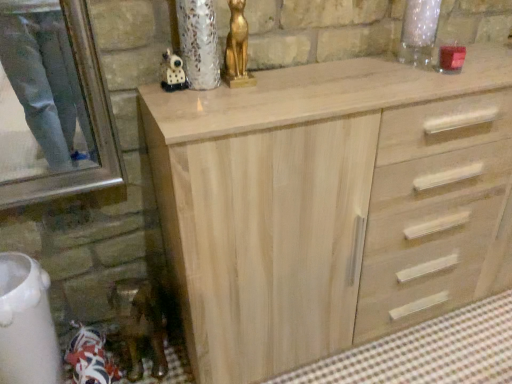
Question: From a real-world perspective, is gold metallic cat statue at upper center physically below natural wood cabinet at center?

Choices:
 (A) yes
 (B) no

Answer: (B)

Question: From the image's perspective, is gold metallic cat statue at upper center located above natural wood cabinet at center?

Choices:
 (A) no
 (B) yes

Answer: (B)

Question: Does gold metallic cat statue at upper center turn towards natural wood cabinet at center?

Choices:
 (A) yes
 (B) no

Answer: (B)

Question: Is gold metallic cat statue at upper center at the right side of natural wood cabinet at center?

Choices:
 (A) no
 (B) yes

Answer: (A)

Question: Is gold metallic cat statue at upper center at the left side of natural wood cabinet at center?

Choices:
 (A) no
 (B) yes

Answer: (B)

Question: Is gold metallic cat statue at upper center wider than natural wood cabinet at center?

Choices:
 (A) no
 (B) yes

Answer: (A)

Question: Is matte black figurine at upper center, positioned as the 1th miniature in right-to-left order, facing away from gold metallic cat statue at upper center?

Choices:
 (A) no
 (B) yes

Answer: (A)

Question: Would you consider matte black figurine at upper center, arranged as the 1th miniature when viewed from the top, to be distant from gold metallic cat statue at upper center?

Choices:
 (A) no
 (B) yes

Answer: (A)

Question: Could gold metallic cat statue at upper center be considered to be inside matte black figurine at upper center, arranged as the 1th miniature when viewed from the top?

Choices:
 (A) yes
 (B) no

Answer: (B)

Question: From the image's perspective, is matte black figurine at upper center, which is the 2th miniature in back-to-front order, beneath gold metallic cat statue at upper center?

Choices:
 (A) yes
 (B) no

Answer: (A)

Question: From a real-world perspective, is matte black figurine at upper center, the 2th miniature when ordered from bottom to top, physically above gold metallic cat statue at upper center?

Choices:
 (A) yes
 (B) no

Answer: (B)

Question: Considering the relative sizes of matte black figurine at upper center, the first miniature from the front, and gold metallic cat statue at upper center in the image provided, is matte black figurine at upper center, the first miniature from the front, smaller than gold metallic cat statue at upper center?

Choices:
 (A) no
 (B) yes

Answer: (B)

Question: From a real-world perspective, does matte black figurine at upper center, the 2th miniature when ordered from bottom to top, sit lower than natural wood cabinet at center?

Choices:
 (A) no
 (B) yes

Answer: (A)